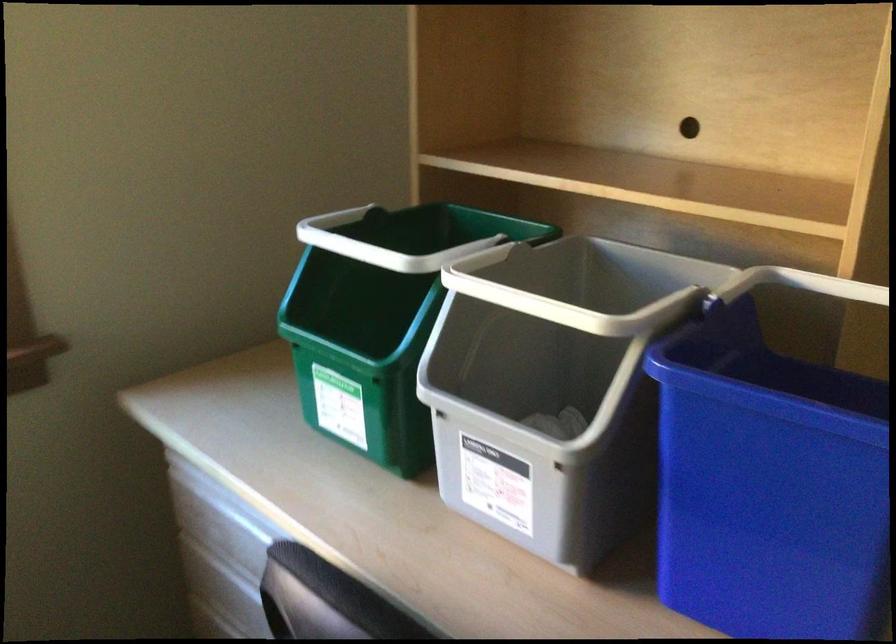
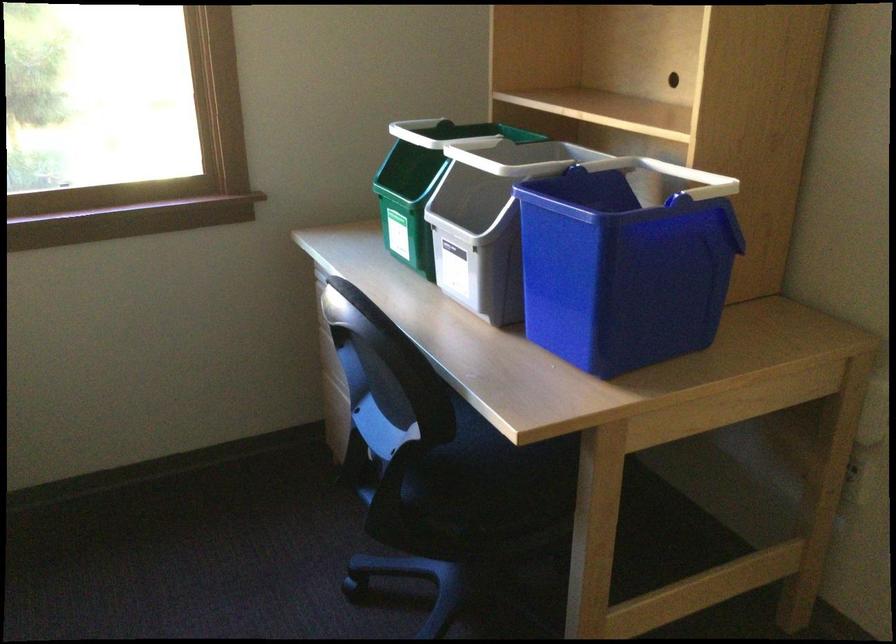
In the second image, find the point that corresponds to (x=356, y=310) in the first image.

(421, 184)